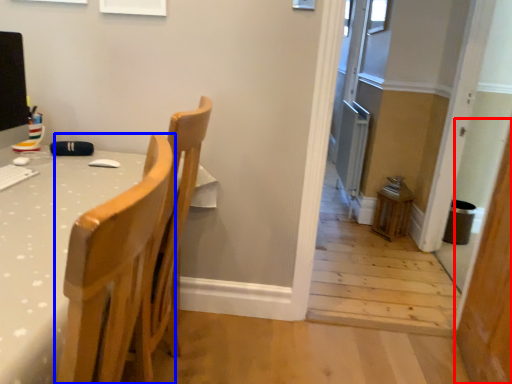
Question: Which object is closer to the camera taking this photo, screen door (highlighted by a red box) or chair (highlighted by a blue box)?

Choices:
 (A) screen door
 (B) chair

Answer: (B)